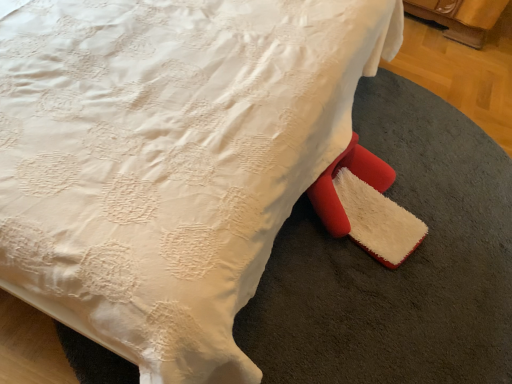
Where is `velvet beige bean bag chair at lower right`? This screenshot has height=384, width=512. velvet beige bean bag chair at lower right is located at coordinates (460, 17).

The image size is (512, 384). What do you see at coordinates (460, 17) in the screenshot?
I see `velvet beige bean bag chair at lower right` at bounding box center [460, 17].

Locate an element on the screen. The width and height of the screenshot is (512, 384). velvet beige bean bag chair at lower right is located at coordinates (460, 17).